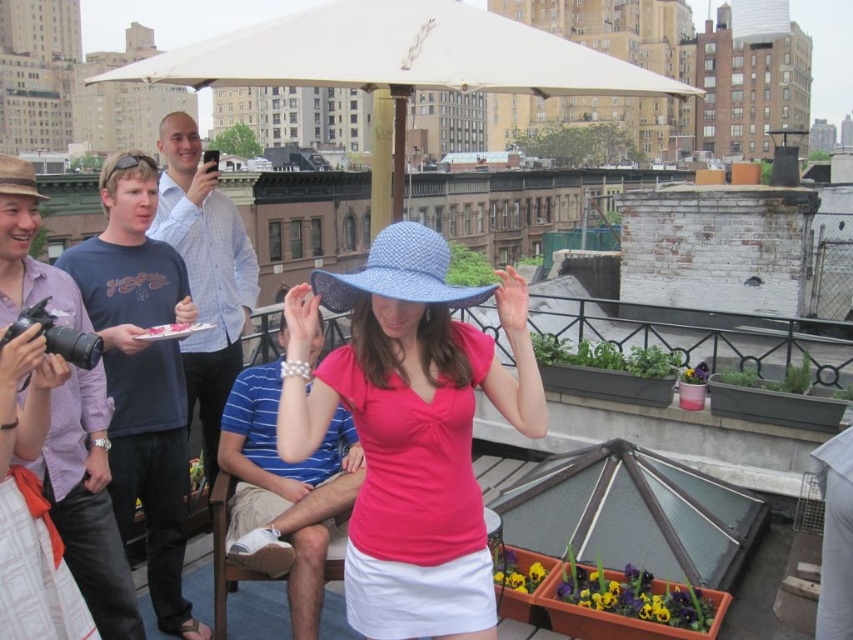
You are at the rooftop gathering and want to place a small decoration on the white paper plate at center without it being blocked by the white fabric canopy at upper center. Is this possible?

The white fabric canopy at upper center is above the white paper plate at center, so placing a small decoration on the white paper plate at center would not be blocked by the canopy as long as it is placed below the canopy.

You are a photographer at the rooftop gathering and need to position yourself so that the white fabric umbrella at upper center and the blue shirt at left are both in your frame. Based on their positions, which object should you place on the right side of your camera viewfinder?

The white fabric umbrella at upper center should be placed on the right side of your camera viewfinder since it is located to the right of the blue shirt at left.

From the picture: You are at a rooftop party and want to take a photo of the blue shirt at left without the white fabric umbrella at upper center blocking the view. Is the umbrella too large to avoid blocking the shot?

The white fabric umbrella at upper center is bigger than the blue shirt at left, so it might block the view depending on the angle and distance. To avoid the umbrella, position yourself where the umbrella cannot cover the blue shirt at left in the frame.